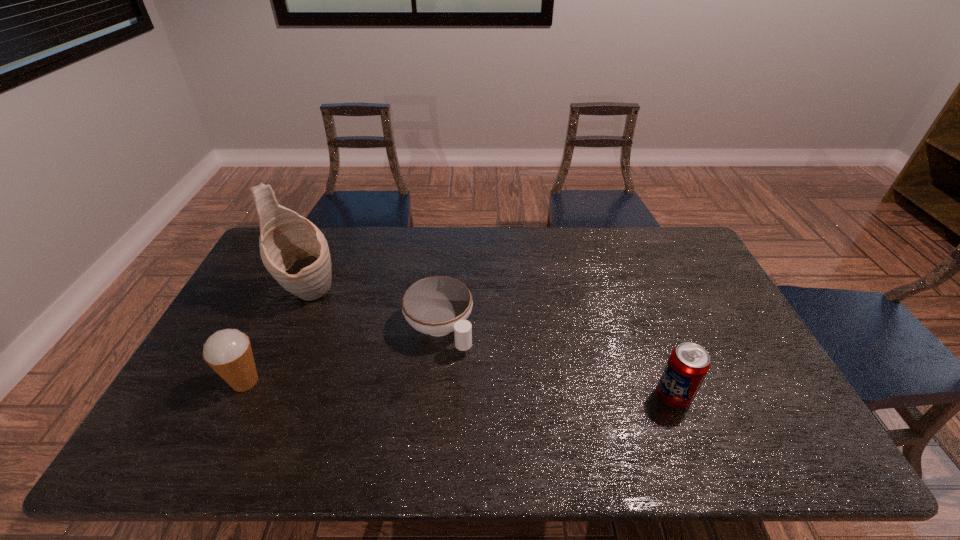
You are a GUI agent. You are given a task and a screenshot of the screen. Output one action in this format:
    pyautogui.click(x=<x>, y=<y>)
    Task: Click on the vacant point located between the shortest object and the icecream
    The image size is (960, 540).
    Given the screenshot: What is the action you would take?
    pyautogui.click(x=342, y=355)

Identify which object is the second nearest to the pitcher. Please provide its 2D coordinates. Your answer should be formatted as a tuple, i.e. [(x, y)], where the tuple contains the x and y coordinates of a point satisfying the conditions above.

[(438, 305)]

This screenshot has width=960, height=540. I want to click on object that stands as the third closest to the icecream, so click(688, 364).

The width and height of the screenshot is (960, 540). What are the coordinates of `free space that satisfies the following two spatial constraints: 1. on the front side of the icecream; 2. on the right side of the rightmost object` in the screenshot? It's located at pos(238,396).

You are a GUI agent. You are given a task and a screenshot of the screen. Output one action in this format:
    pyautogui.click(x=<x>, y=<y>)
    Task: Click on the free space that satisfies the following two spatial constraints: 1. on the back side of the icecream; 2. on the right side of the pitcher
    This screenshot has width=960, height=540.
    Given the screenshot: What is the action you would take?
    pyautogui.click(x=287, y=294)